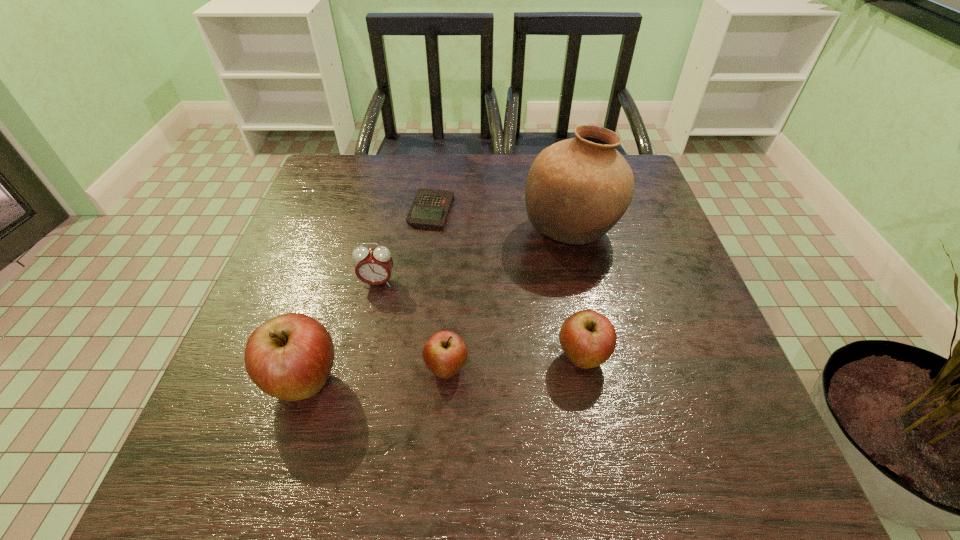
Locate an element on the screen. The width and height of the screenshot is (960, 540). the tallest apple is located at coordinates (289, 357).

What are the coordinates of `the fifth shortest object` in the screenshot? It's located at coord(289,357).

This screenshot has height=540, width=960. In order to click on the second apple from left to right in this screenshot , I will do `click(445, 353)`.

Where is `the second tallest apple`? the second tallest apple is located at coordinates (588, 338).

Identify the location of the shortest object. (430, 208).

Locate an element on the screen. This screenshot has height=540, width=960. alarm clock is located at coordinates (374, 266).

This screenshot has height=540, width=960. What are the coordinates of `the tallest object` in the screenshot? It's located at (577, 189).

Image resolution: width=960 pixels, height=540 pixels. I want to click on vacant space situated on the right of the second tallest object, so click(x=459, y=382).

You are a GUI agent. You are given a task and a screenshot of the screen. Output one action in this format:
    pyautogui.click(x=<x>, y=<y>)
    Task: Click on the vacant area situated 0.100m on the back of the shortest apple
    The image size is (960, 540).
    Given the screenshot: What is the action you would take?
    pyautogui.click(x=450, y=311)

Find the location of a particular element. This screenshot has width=960, height=540. vacant region located on the left of the rightmost apple is located at coordinates (456, 357).